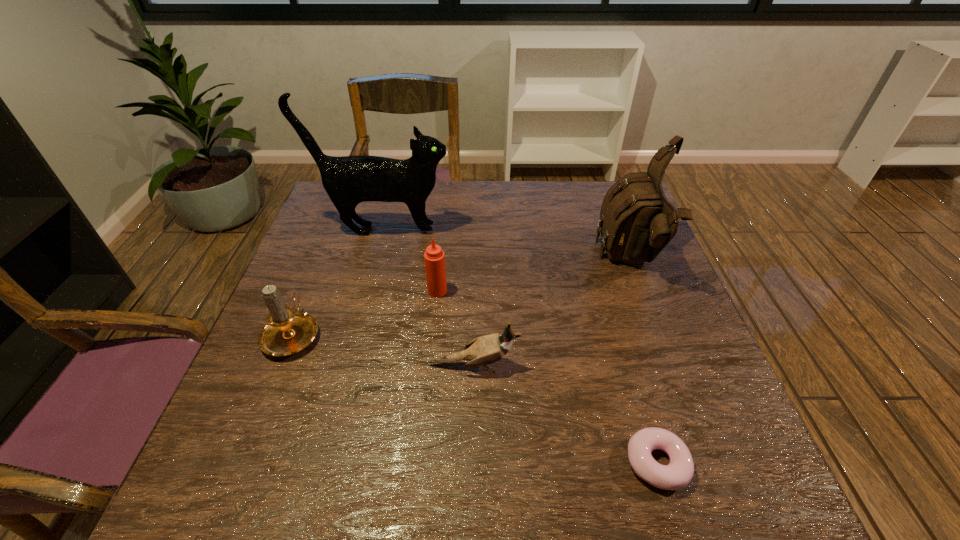
Where is `the tallest object`? Image resolution: width=960 pixels, height=540 pixels. the tallest object is located at coordinates (349, 180).

Locate an element on the screen. shoulder bag is located at coordinates (637, 221).

Identify the location of candle. Image resolution: width=960 pixels, height=540 pixels. (286, 332).

Image resolution: width=960 pixels, height=540 pixels. I want to click on Tabasco sauce, so click(x=434, y=257).

Find the location of a particular element. This screenshot has width=960, height=540. the fifth tallest object is located at coordinates (484, 350).

Find the location of a particular element. This screenshot has height=540, width=960. the nearest object is located at coordinates tap(677, 474).

At what (x,y) coordinates should I click in order to perform the action: click on doughnut. Please return your answer as a coordinate pair (x, y). This screenshot has height=540, width=960. Looking at the image, I should click on click(677, 474).

This screenshot has width=960, height=540. Find the location of `blank space located on the face of the cat`. blank space located on the face of the cat is located at coordinates (564, 230).

You are a GUI agent. You are given a task and a screenshot of the screen. Output one action in this format:
    pyautogui.click(x=<x>, y=<y>)
    Task: Click on the free space located 0.270m on the front-facing side of the second tallest object
    The width and height of the screenshot is (960, 540).
    Given the screenshot: What is the action you would take?
    pyautogui.click(x=499, y=261)

Where is `vacant space located on the front-facing side of the second tallest object`? vacant space located on the front-facing side of the second tallest object is located at coordinates (533, 261).